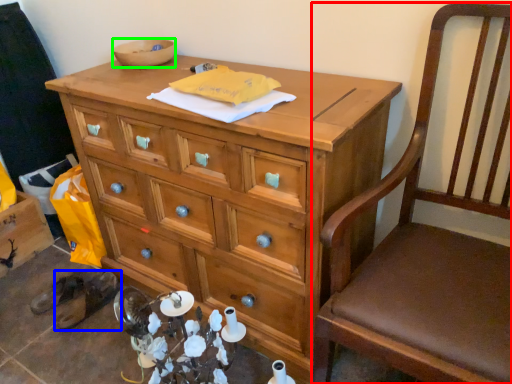
Question: Estimate the real-world distances between objects in this image. Which object is farther from chair (highlighted by a red box), footwear (highlighted by a blue box) or bowl (highlighted by a green box)?

Choices:
 (A) footwear
 (B) bowl

Answer: (A)